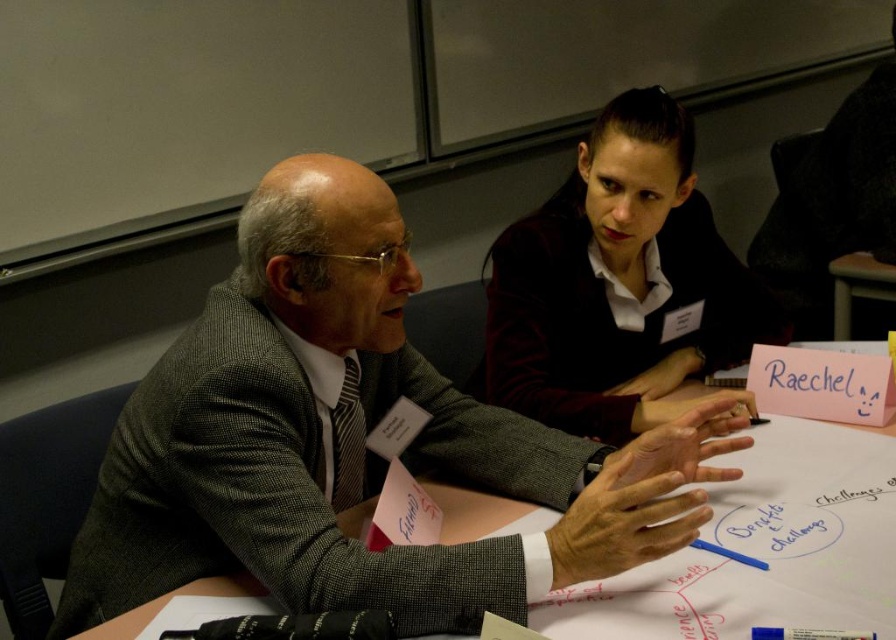
You are taking a photo of the two points in the image. Which point, point [576,518] or point [610,248], will appear larger in your photo?

Point [576,518] is closer to the camera than point [610,248], so it will appear larger in the photo.